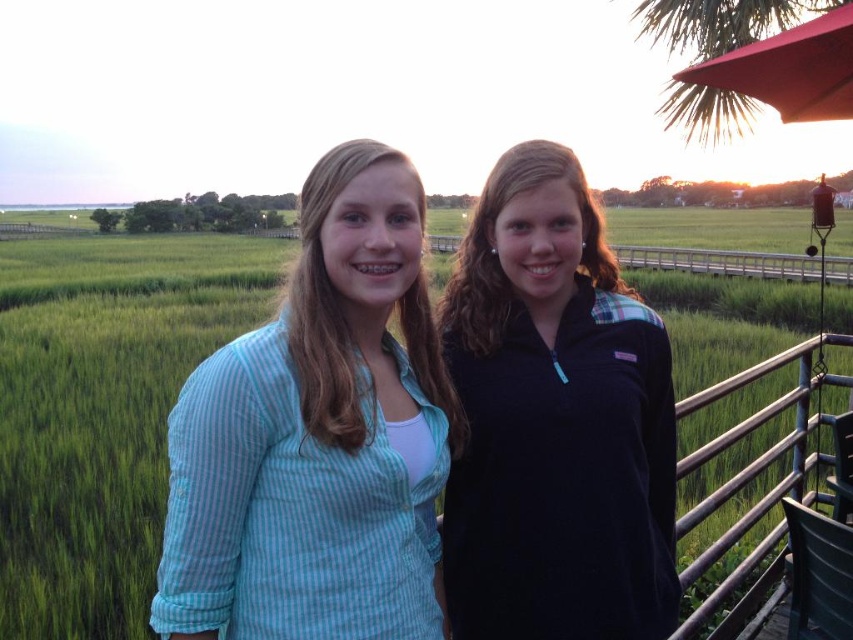
Does light blue striped shirt at center appear on the left side of metallic silver railing at right?

Yes, light blue striped shirt at center is to the left of metallic silver railing at right.

Which is in front, point (263, 580) or point (844, 384)?

Point (263, 580) is in front.

In order to click on light blue striped shirt at center in this screenshot , I will do `click(317, 435)`.

Which of these two, light blue striped shirt at center or dark blue fleece at center, stands shorter?

With less height is light blue striped shirt at center.

The image size is (853, 640). What are the coordinates of `light blue striped shirt at center` in the screenshot? It's located at (317, 435).

The image size is (853, 640). What do you see at coordinates (555, 420) in the screenshot?
I see `dark blue fleece at center` at bounding box center [555, 420].

Is dark blue fleece at center to the left of metallic silver railing at right from the viewer's perspective?

Yes, dark blue fleece at center is to the left of metallic silver railing at right.

Which is in front, point (624, 532) or point (697, 624)?

Point (624, 532) is more forward.

At what (x,y) coordinates should I click in order to perform the action: click on dark blue fleece at center. Please return your answer as a coordinate pair (x, y). Image resolution: width=853 pixels, height=640 pixels. Looking at the image, I should click on (555, 420).